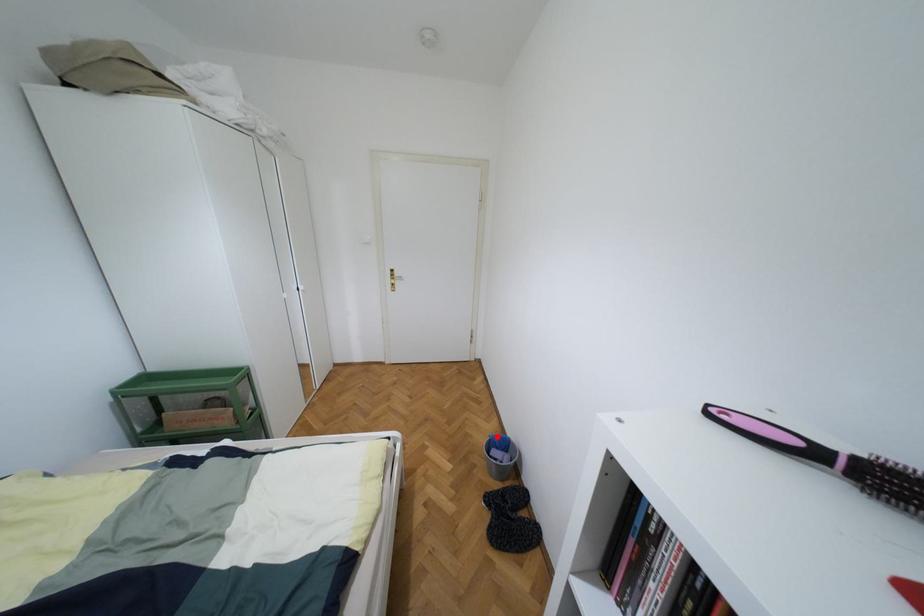
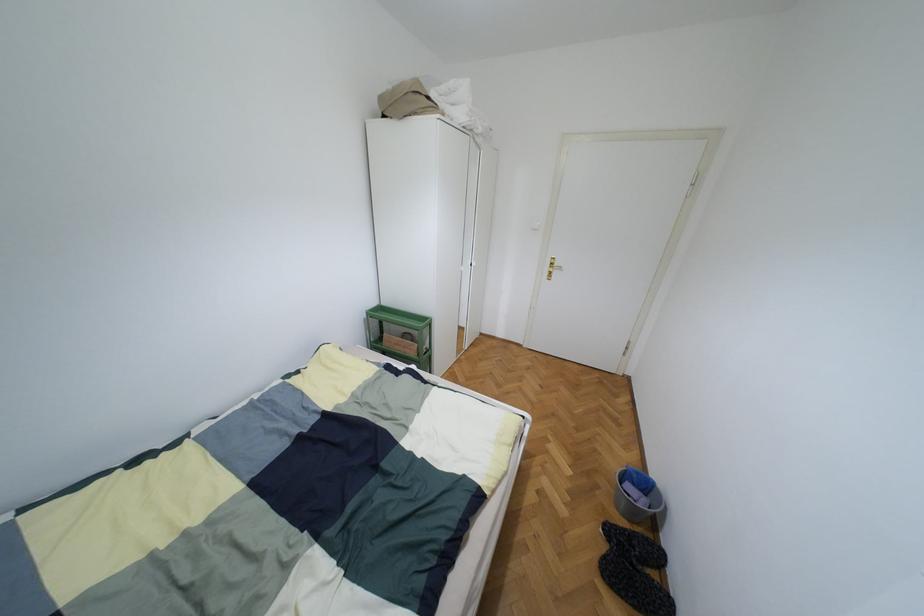
Where in the second image is the point corresponding to the highlighted location from the first image?

(638, 472)